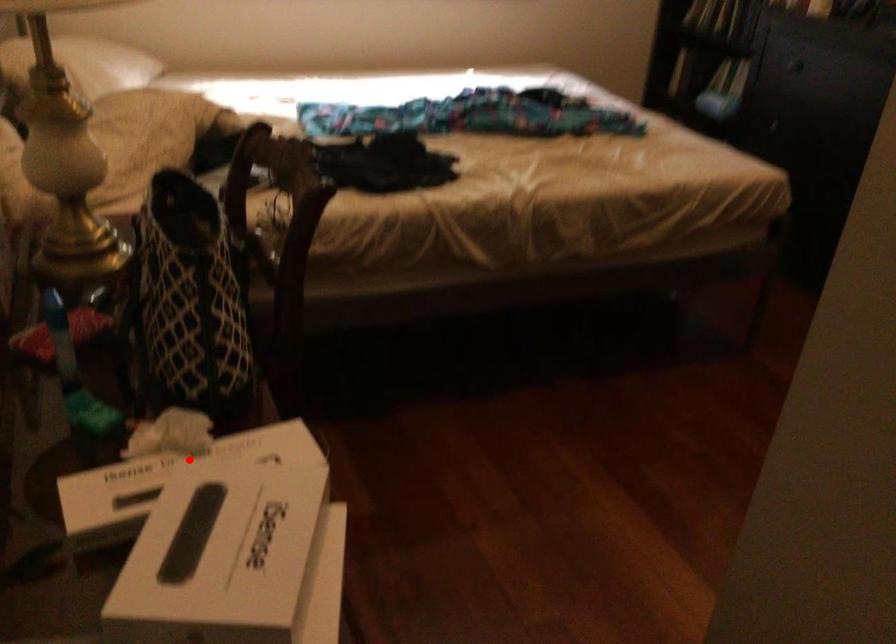
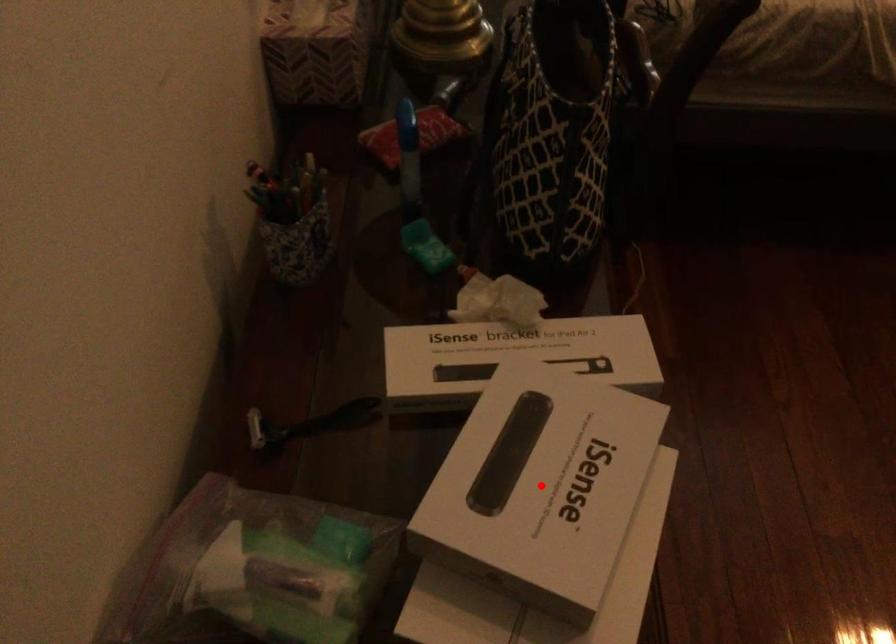
I am providing you with two images of the same scene from different viewpoints. A red point is marked on the first image and another point is marked on the second image. Do the highlighted points in image1 and image2 indicate the same real-world spot?

No